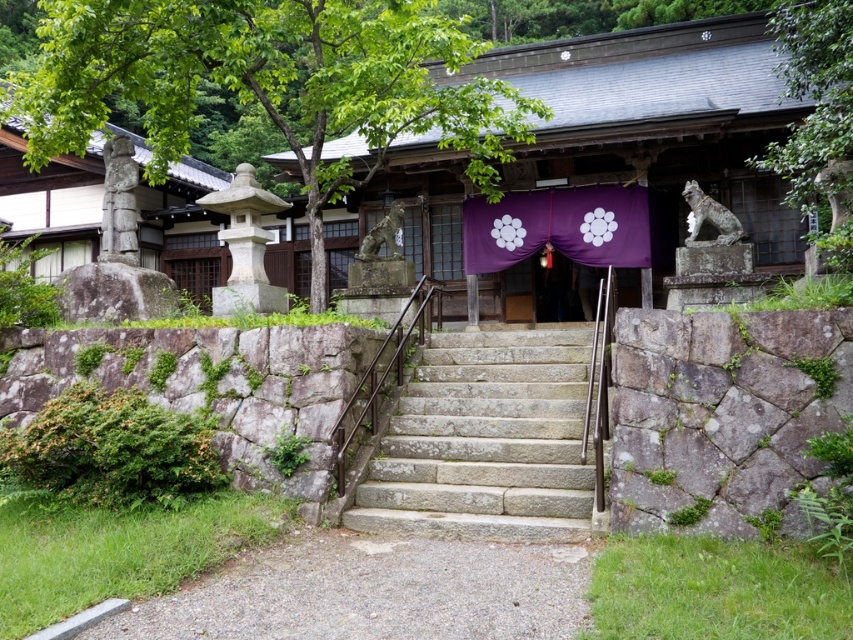
Is green leafy tree at left closer to camera compared to gray stone stairs at center?

No.

Does point (265, 19) lie behind point (459, 493)?

Yes, point (265, 19) is farther from viewer.

What are the coordinates of `green leafy tree at left` in the screenshot? It's located at (270, 84).

Is the position of green leafy tree at left more distant than that of purple satin curtain at center?

No.

Does green leafy tree at left have a lesser width compared to purple satin curtain at center?

In fact, green leafy tree at left might be wider than purple satin curtain at center.

Describe the element at coordinates (270, 84) in the screenshot. I see `green leafy tree at left` at that location.

Image resolution: width=853 pixels, height=640 pixels. I want to click on green leafy tree at left, so tap(270, 84).

Can you confirm if gray stone stairs at center is smaller than green leafy tree at upper right?

Actually, gray stone stairs at center might be larger than green leafy tree at upper right.

Is point (527, 458) less distant than point (796, 140)?

Yes, point (527, 458) is closer to viewer.

Who is more distant from viewer, (531,404) or (801,19)?

The point (801,19) is more distant.

Where is `gray stone stairs at center`? gray stone stairs at center is located at coordinates tap(486, 440).